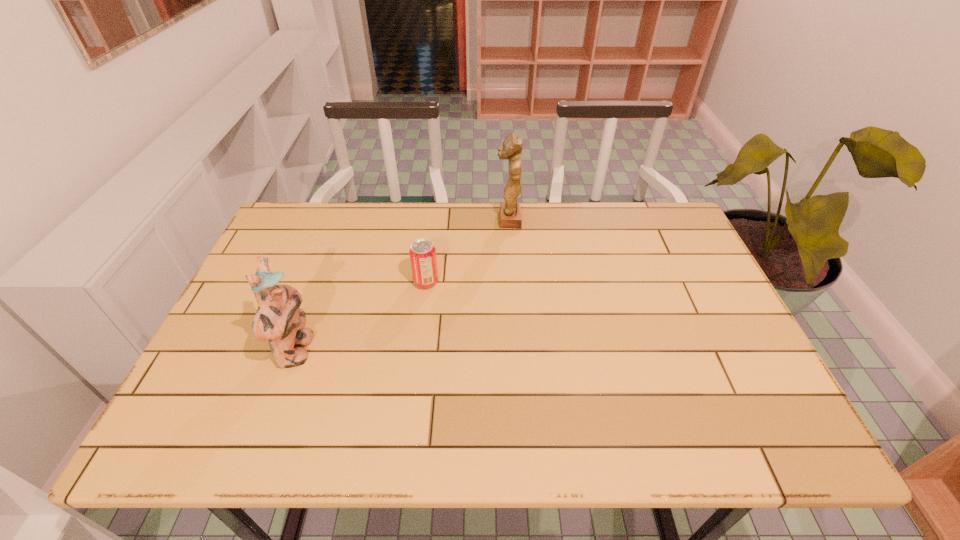
Identify the location of free area in between the nearer figurine and the soda. (361, 317).

Image resolution: width=960 pixels, height=540 pixels. What are the coordinates of `free space between the shortest object and the nearest object` in the screenshot? It's located at (361, 317).

Where is `blank region between the soda and the nearest object`? Image resolution: width=960 pixels, height=540 pixels. blank region between the soda and the nearest object is located at coordinates (361, 317).

Identify the location of free space between the shortest object and the rightmost object. The image size is (960, 540). (468, 251).

Locate an element on the screen. vacant area that lies between the farthest object and the second object from left to right is located at coordinates (468, 251).

Find the location of a particular element. This screenshot has height=540, width=960. free area in between the right figurine and the second object from left to right is located at coordinates (468, 251).

Locate an element on the screen. vacant area that lies between the shortest object and the farthest object is located at coordinates (468, 251).

Locate which object ranks second in proximity to the left figurine. Please provide its 2D coordinates. Your answer should be formatted as a tuple, i.e. [(x, y)], where the tuple contains the x and y coordinates of a point satisfying the conditions above.

[(510, 212)]

Identify the location of object that ranks as the second closest to the second nearest object. (510, 212).

At what (x,y) coordinates should I click in order to perform the action: click on free location that satisfies the following two spatial constraints: 1. on the front-facing side of the rightmost object; 2. on the front side of the second object from left to right. Please return your answer as a coordinate pair (x, y). The width and height of the screenshot is (960, 540). Looking at the image, I should click on (513, 282).